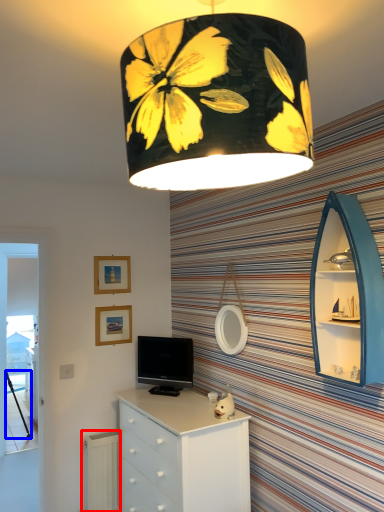
Question: Which point is closer to the camera, radiator (highlighted by a red box) or tripod (highlighted by a blue box)?

Choices:
 (A) radiator
 (B) tripod

Answer: (A)